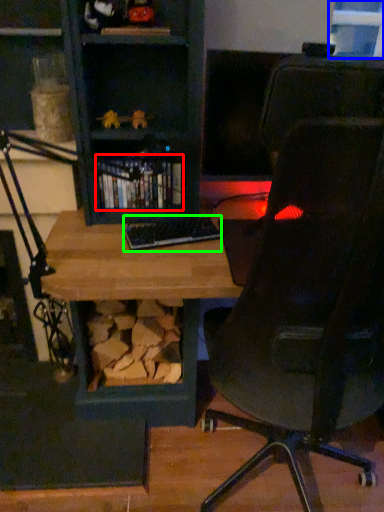
Question: Based on their relative distances, which object is nearer to book (highlighted by a red box)? Choose from window (highlighted by a blue box) and keyboard (highlighted by a green box).

Choices:
 (A) window
 (B) keyboard

Answer: (B)